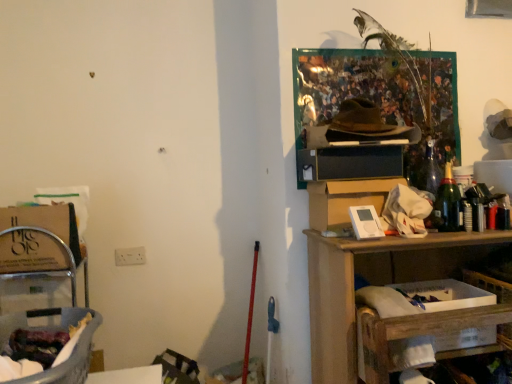
Question: Is white cardboard box at upper right, positioned as the first cardboard box in right-to-left order, to the left of wooden shelf at right from the viewer's perspective?

Choices:
 (A) yes
 (B) no

Answer: (A)

Question: Is white cardboard box at upper right, positioned as the first cardboard box in right-to-left order, smaller than wooden shelf at right?

Choices:
 (A) no
 (B) yes

Answer: (B)

Question: From the image's perspective, is white cardboard box at upper right, which is counted as the second cardboard box, starting from the left, on top of wooden shelf at right?

Choices:
 (A) yes
 (B) no

Answer: (A)

Question: Does white cardboard box at upper right, positioned as the first cardboard box in right-to-left order, turn towards wooden shelf at right?

Choices:
 (A) no
 (B) yes

Answer: (A)

Question: Would you say white cardboard box at upper right, which is counted as the second cardboard box, starting from the left, contains wooden shelf at right?

Choices:
 (A) yes
 (B) no

Answer: (B)

Question: Is wooden shelf at right taller or shorter than white cardboard box at upper right, positioned as the first cardboard box in right-to-left order?

Choices:
 (A) short
 (B) tall

Answer: (B)

Question: Is wooden shelf at right situated inside white cardboard box at upper right, which is counted as the second cardboard box, starting from the left, or outside?

Choices:
 (A) outside
 (B) inside

Answer: (A)

Question: Relative to white cardboard box at upper right, positioned as the first cardboard box in right-to-left order, is wooden shelf at right in front or behind?

Choices:
 (A) front
 (B) behind

Answer: (A)

Question: In terms of width, does wooden shelf at right look wider or thinner when compared to white cardboard box at upper right, which is counted as the second cardboard box, starting from the left?

Choices:
 (A) thin
 (B) wide

Answer: (B)

Question: From the image's perspective, relative to wooden shelf at right, is translucent plastic laundry basket at lower left above or below?

Choices:
 (A) below
 (B) above

Answer: (B)

Question: Is point (94, 311) positioned closer to the camera than point (330, 254)?

Choices:
 (A) farther
 (B) closer

Answer: (A)

Question: Relative to wooden shelf at right, is translucent plastic laundry basket at lower left in front or behind?

Choices:
 (A) front
 (B) behind

Answer: (A)

Question: From a real-world perspective, relative to wooden shelf at right, is translucent plastic laundry basket at lower left vertically above or below?

Choices:
 (A) below
 (B) above

Answer: (B)

Question: Would you say matte brown cardboard box at left, placed as the second cardboard box when sorted from right to left, is to the left or to the right of white cardboard box at lower right in the picture?

Choices:
 (A) right
 (B) left

Answer: (B)

Question: Is matte brown cardboard box at left, placed as the second cardboard box when sorted from right to left, wider or thinner than white cardboard box at lower right?

Choices:
 (A) wide
 (B) thin

Answer: (B)